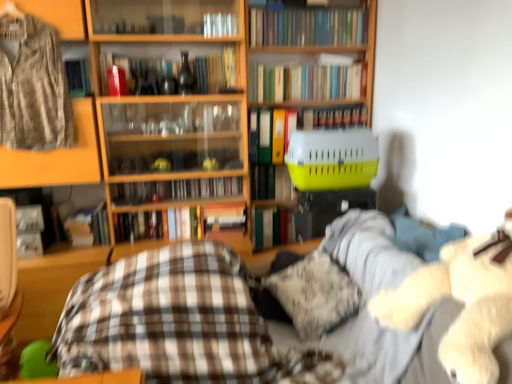
Question: Is yellow plastic pet carrier at center facing towards fluffy white teddy bear at right?

Choices:
 (A) no
 (B) yes

Answer: (B)

Question: From the image's perspective, is yellow plastic pet carrier at center on top of fluffy white teddy bear at right?

Choices:
 (A) no
 (B) yes

Answer: (B)

Question: Can you confirm if yellow plastic pet carrier at center is taller than fluffy white teddy bear at right?

Choices:
 (A) no
 (B) yes

Answer: (A)

Question: Can fluffy white teddy bear at right be found inside yellow plastic pet carrier at center?

Choices:
 (A) no
 (B) yes

Answer: (A)

Question: Is yellow plastic pet carrier at center bigger than fluffy white teddy bear at right?

Choices:
 (A) yes
 (B) no

Answer: (B)

Question: From the image's perspective, is camouflage fabric shirt at left located above or below hardcover book at center, the 2th book in the bottom-to-top sequence?

Choices:
 (A) above
 (B) below

Answer: (A)

Question: Is point (27, 140) closer or farther from the camera than point (267, 211)?

Choices:
 (A) farther
 (B) closer

Answer: (B)

Question: From a real-world perspective, is camouflage fabric shirt at left above or below hardcover book at center, the 2th book in the bottom-to-top sequence?

Choices:
 (A) below
 (B) above

Answer: (B)

Question: Which is correct: camouflage fabric shirt at left is inside hardcover book at center, which appears as the 9th book when viewed from the top, or outside of it?

Choices:
 (A) inside
 (B) outside

Answer: (B)

Question: From the image's perspective, relative to hardcover book at center, the 7th book viewed from the top, is green matte file folder at center, which is the fourth book from top to bottom, above or below?

Choices:
 (A) above
 (B) below

Answer: (A)

Question: In the image, is green matte file folder at center, which is the fourth book from top to bottom, positioned in front of or behind hardcover book at center, the 7th book viewed from the top?

Choices:
 (A) behind
 (B) front

Answer: (B)

Question: In terms of size, does green matte file folder at center, which is the fourth book from top to bottom, appear bigger or smaller than hardcover book at center, the 7th book viewed from the top?

Choices:
 (A) big
 (B) small

Answer: (A)

Question: Looking at their shapes, would you say green matte file folder at center, positioned as the seventh book in bottom-to-top order, is wider or thinner than hardcover book at center, the fourth book positioned from the bottom?

Choices:
 (A) wide
 (B) thin

Answer: (B)

Question: Based on their positions, is matte glass wine bottle at upper center located to the left or right of fluffy white teddy bear at right?

Choices:
 (A) right
 (B) left

Answer: (B)

Question: From a real-world perspective, is matte glass wine bottle at upper center physically located above or below fluffy white teddy bear at right?

Choices:
 (A) below
 (B) above

Answer: (B)